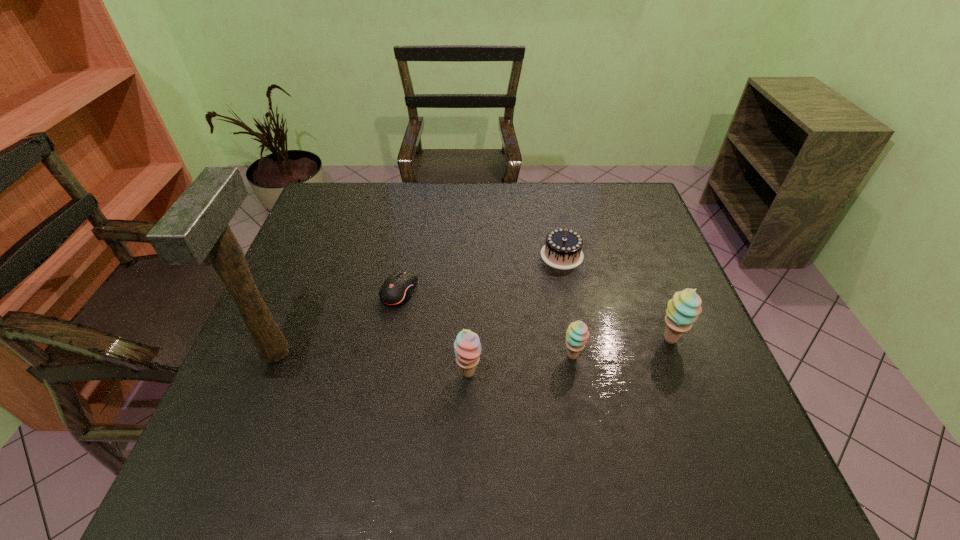
I want to click on vacant region between the leftmost sherbert and the fifth tallest object, so click(516, 315).

At what (x,y) coordinates should I click in order to perform the action: click on blank region between the second tallest sherbert and the second sherbert from right to left. Please return your answer as a coordinate pair (x, y). Looking at the image, I should click on (520, 365).

Image resolution: width=960 pixels, height=540 pixels. Find the location of `object identified as the second closest to the farthest object`. object identified as the second closest to the farthest object is located at coordinates (577, 333).

Point out which object is positioned as the fourth nearest to the rightmost object. Please provide its 2D coordinates. Your answer should be formatted as a tuple, i.e. [(x, y)], where the tuple contains the x and y coordinates of a point satisfying the conditions above.

[(397, 289)]

This screenshot has height=540, width=960. I want to click on sherbert that is the second closest to the tallest object, so click(x=577, y=333).

Select which sherbert is the closest to the second farthest object. Please provide its 2D coordinates. Your answer should be formatted as a tuple, i.e. [(x, y)], where the tuple contains the x and y coordinates of a point satisfying the conditions above.

[(467, 345)]